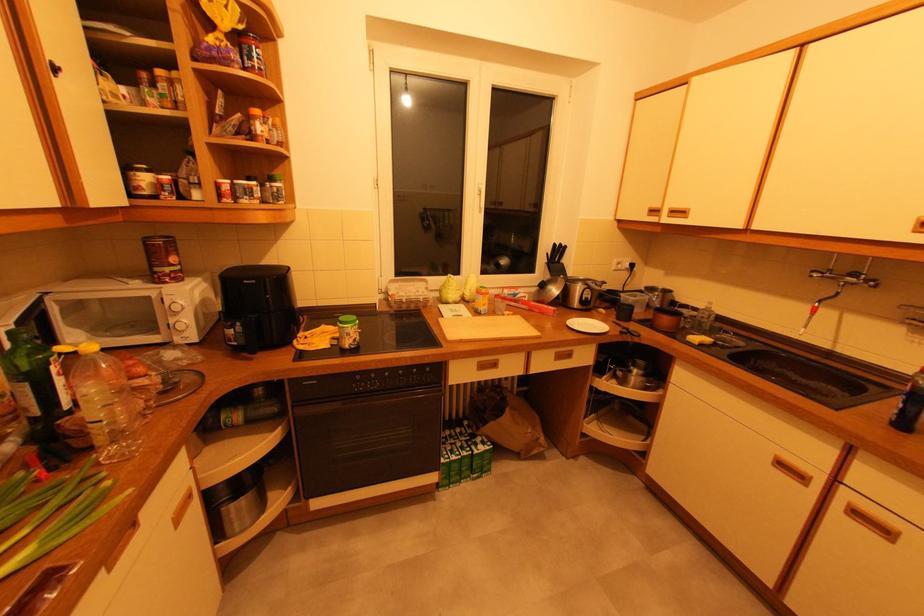
Find where to lift the black plastic bottle. Please return your answer as a coordinate pair (x, y).

(909, 405)